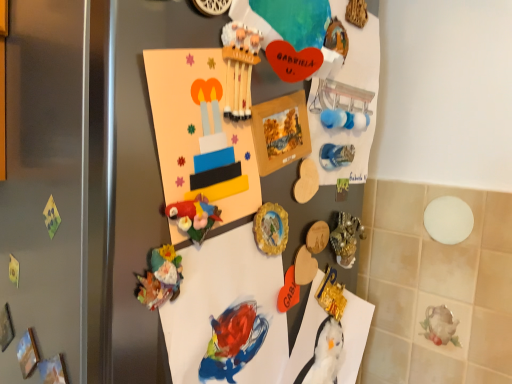
Based on the photo, what is the approximate height of plush fabric toy at lower left, marked as the third toy in a back-to-front arrangement?

It is 2.85 inches.

Image resolution: width=512 pixels, height=384 pixels. Describe the element at coordinates (227, 149) in the screenshot. I see `matte cardboard poster at center` at that location.

Identify the location of matte orange heart at center, placed as the first toy when sorted from back to front. The height and width of the screenshot is (384, 512). (288, 291).

Image resolution: width=512 pixels, height=384 pixels. Identify the location of wooden matches at center, positioned as the second toy in back-to-front order. (239, 68).

This screenshot has height=384, width=512. Describe the element at coordinates (336, 155) in the screenshot. I see `blue glossy magnet at upper right, which is the 1th art in top-to-bottom order` at that location.

What do you see at coordinates (271, 228) in the screenshot? The image size is (512, 384). I see `gold metallic button at center` at bounding box center [271, 228].

Measure the distance between point (257, 237) and camera.

A distance of 22.68 inches exists between point (257, 237) and camera.

This screenshot has width=512, height=384. Find the location of `plush fabric toy at lower left, the 2th toy in the top-to-bottom sequence`. plush fabric toy at lower left, the 2th toy in the top-to-bottom sequence is located at coordinates 160,277.

Between matte orange heart at center, placed as the first toy when sorted from back to front, and matte cardboard poster at center, which one has more height?

matte cardboard poster at center is taller.

Considering the positions of point (288, 272) and point (264, 347), is point (288, 272) closer or farther from the camera than point (264, 347)?

Point (288, 272) is farther from the camera than point (264, 347).

From the image's perspective, is blue glossy magnet at upper right, the second art from the bottom, above matte orange heart at center, the first toy when ordered from right to left?

Yes.

Is blue glossy magnet at upper right, the second art from the bottom, positioned far away from matte orange heart at center, which is the first toy in bottom-to-top order?

blue glossy magnet at upper right, the second art from the bottom, is near matte orange heart at center, which is the first toy in bottom-to-top order, not far away.

Which is more to the right, blue glossy magnet at upper right, which is the 1th art in top-to-bottom order, or matte orange heart at center, placed as the first toy when sorted from back to front?

Positioned to the right is blue glossy magnet at upper right, which is the 1th art in top-to-bottom order.

Does blue glossy magnet at upper right, which is the 1th art in top-to-bottom order, have a smaller size compared to matte orange heart at center, placed as the first toy when sorted from back to front?

No.

Identify the location of collection to the right of wooden matches at center, the 2th toy viewed from the left. Image resolution: width=512 pixels, height=384 pixels. (227, 149).

Is wooden matches at center, arranged as the 1th toy when viewed from the top, taller than matte cardboard poster at center?

No, wooden matches at center, arranged as the 1th toy when viewed from the top, is not taller than matte cardboard poster at center.

Based on their sizes in the image, would you say wooden matches at center, positioned as the second toy in front-to-back order, is bigger or smaller than matte cardboard poster at center?

wooden matches at center, positioned as the second toy in front-to-back order, is smaller than matte cardboard poster at center.

Considering their positions, is wooden matches at center, arranged as the 1th toy when viewed from the top, located in front of or behind matte cardboard poster at center?

In the image, wooden matches at center, arranged as the 1th toy when viewed from the top, appears behind matte cardboard poster at center.

Is gold metallic vase at center-right, which is the 1th art from bottom to top, further to camera compared to gold metallic button at center?

That is True.

Which of these two, gold metallic vase at center-right, acting as the second art starting from the top, or gold metallic button at center, stands taller?

gold metallic vase at center-right, acting as the second art starting from the top.

The image size is (512, 384). What are the coordinates of `button above the gold metallic vase at center-right, acting as the second art starting from the top (from a real-world perspective)` in the screenshot? It's located at (271, 228).

Does wooden matches at center, the 2th toy viewed from the left, have a lesser height compared to plush fabric toy at lower left, marked as the 2th toy in a bottom-to-top arrangement?

Correct, wooden matches at center, the 2th toy viewed from the left, is not as tall as plush fabric toy at lower left, marked as the 2th toy in a bottom-to-top arrangement.

Consider the image. From a real-world perspective, is wooden matches at center, the 3th toy in the bottom-to-top sequence, physically located above or below plush fabric toy at lower left, which is the first toy from left to right?

Clearly, from a real-world perspective, wooden matches at center, the 3th toy in the bottom-to-top sequence, is above plush fabric toy at lower left, which is the first toy from left to right.

Does point (239, 46) appear closer or farther from the camera than point (152, 289)?

Point (239, 46).

In terms of width, does wooden matches at center, positioned as the second toy in back-to-front order, look wider or thinner when compared to blue glossy magnet at upper right, which is the 1th art in top-to-bottom order?

Considering their sizes, wooden matches at center, positioned as the second toy in back-to-front order, looks slimmer than blue glossy magnet at upper right, which is the 1th art in top-to-bottom order.

Is wooden matches at center, the second toy viewed from the right, to the right of blue glossy magnet at upper right, which is the 1th art in top-to-bottom order, from the viewer's perspective?

In fact, wooden matches at center, the second toy viewed from the right, is to the left of blue glossy magnet at upper right, which is the 1th art in top-to-bottom order.

Is wooden matches at center, the second toy viewed from the right, not close to blue glossy magnet at upper right, which is the 1th art in top-to-bottom order?

Actually, wooden matches at center, the second toy viewed from the right, and blue glossy magnet at upper right, which is the 1th art in top-to-bottom order, are a little close together.

From the image's perspective, who appears lower, wooden matches at center, positioned as the second toy in front-to-back order, or blue glossy magnet at upper right, the second art from the bottom?

blue glossy magnet at upper right, the second art from the bottom.

From a real-world perspective, is gold metallic button at center positioned over matte paper postcard at center based on gravity?

Incorrect, from a real-world perspective, gold metallic button at center is lower than matte paper postcard at center.

Does gold metallic button at center have a greater height compared to matte paper postcard at center?

In fact, gold metallic button at center may be shorter than matte paper postcard at center.

Considering the points (287, 226) and (234, 157), which point is in front, point (287, 226) or point (234, 157)?

The point (234, 157) is closer to the camera.

Does gold metallic button at center have a greater width compared to matte paper postcard at center?

No, gold metallic button at center is not wider than matte paper postcard at center.

This screenshot has height=384, width=512. Find the location of `the 3rd toy behind the matte cardboard poster at center, starting your count from the anchor`. the 3rd toy behind the matte cardboard poster at center, starting your count from the anchor is located at coordinates (288, 291).

Find the location of a particular element. art that is the 1st object to the right of the matte orange heart at center, which is the 3th toy from left to right, starting at the anchor is located at coordinates (336, 155).

Which object lies further to the anchor point gold metallic vase at center-right, acting as the second art starting from the top, matte cardboard poster at center or matte orange heart at center, the first toy when ordered from right to left?

matte cardboard poster at center lies further to gold metallic vase at center-right, acting as the second art starting from the top, than the other object.

When comparing their distances from matte cardboard poster at center, does blue glossy magnet at upper right, the second art from the bottom, or gold metallic button at center seem closer?

gold metallic button at center is closer to matte cardboard poster at center.

Considering their positions, is gold metallic button at center positioned further to matte cardboard poster at center than matte orange heart at center, which appears as the 3th toy when viewed from the top?

Based on the image, matte orange heart at center, which appears as the 3th toy when viewed from the top, appears to be further to matte cardboard poster at center.

When comparing their distances from gold metallic button at center, does blue glossy magnet at upper right, the second art from the bottom, or wooden matches at center, the 2th toy viewed from the left, seem further?

wooden matches at center, the 2th toy viewed from the left.

Based on their spatial positions, is plush fabric toy at lower left, the 2th toy in the top-to-bottom sequence, or gold metallic vase at center-right, which is the 1th art from bottom to top, further from matte orange heart at center, which is the first toy in bottom-to-top order?

plush fabric toy at lower left, the 2th toy in the top-to-bottom sequence, is further to matte orange heart at center, which is the first toy in bottom-to-top order.

From the image, which object appears to be farther from matte cardboard poster at center, blue glossy magnet at upper right, which is the 1th art in top-to-bottom order, or plush fabric toy at lower left, which is the first toy from left to right?

blue glossy magnet at upper right, which is the 1th art in top-to-bottom order.

Based on the photo, when comparing their distances from plush fabric toy at lower left, which is the first toy from left to right, does gold metallic vase at center-right, which is the 1th art from bottom to top, or matte orange heart at center, which is the 3th toy from left to right, seem closer?

Among the two, matte orange heart at center, which is the 3th toy from left to right, is located nearer to plush fabric toy at lower left, which is the first toy from left to right.

Looking at this image, considering their positions, is blue glossy magnet at upper right, which is the 1th art in top-to-bottom order, positioned further to gold metallic vase at center-right, acting as the second art starting from the top, than gold metallic button at center?

gold metallic button at center is further to gold metallic vase at center-right, acting as the second art starting from the top.

The image size is (512, 384). Find the location of `button between matte paper postcard at center and plush fabric toy at lower left, which is counted as the 3th toy, starting from the right, in the vertical direction`. button between matte paper postcard at center and plush fabric toy at lower left, which is counted as the 3th toy, starting from the right, in the vertical direction is located at coordinates (271, 228).

This screenshot has height=384, width=512. I want to click on button that lies between blue glossy magnet at upper right, which is the 1th art in top-to-bottom order, and matte orange heart at center, which is the first toy in bottom-to-top order, from top to bottom, so click(271, 228).

Find the location of a particular element. Image resolution: width=512 pixels, height=384 pixels. button between matte paper postcard at center and blue glossy magnet at upper right, which is the 1th art in top-to-bottom order, in the front-back direction is located at coordinates (271, 228).

You are a GUI agent. You are given a task and a screenshot of the screen. Output one action in this format:
    pyautogui.click(x=<x>, y=<y>)
    Task: Click on the button between matte paper postcard at center and matte orange heart at center, placed as the first toy when sorted from back to front, in the front-back direction
    The image size is (512, 384).
    Given the screenshot: What is the action you would take?
    pyautogui.click(x=271, y=228)